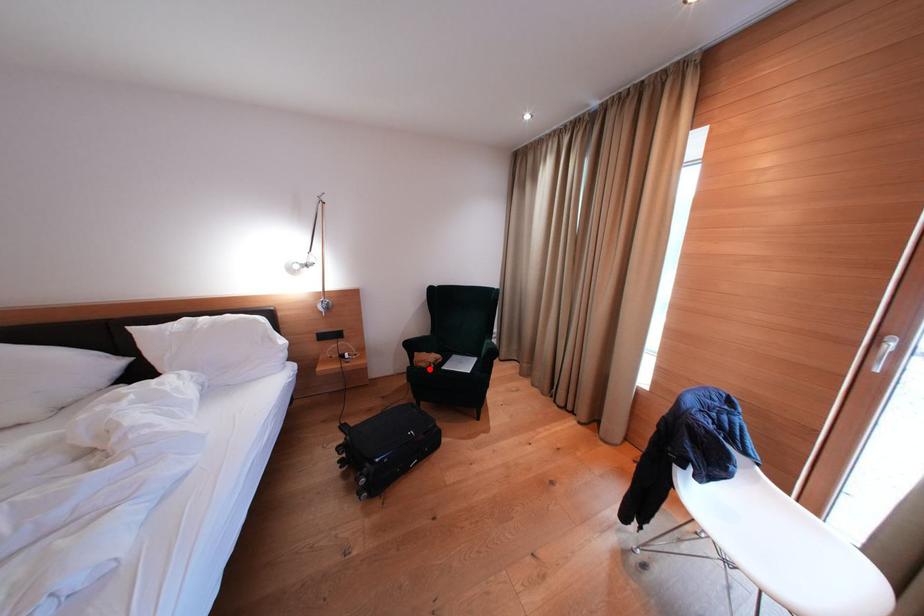
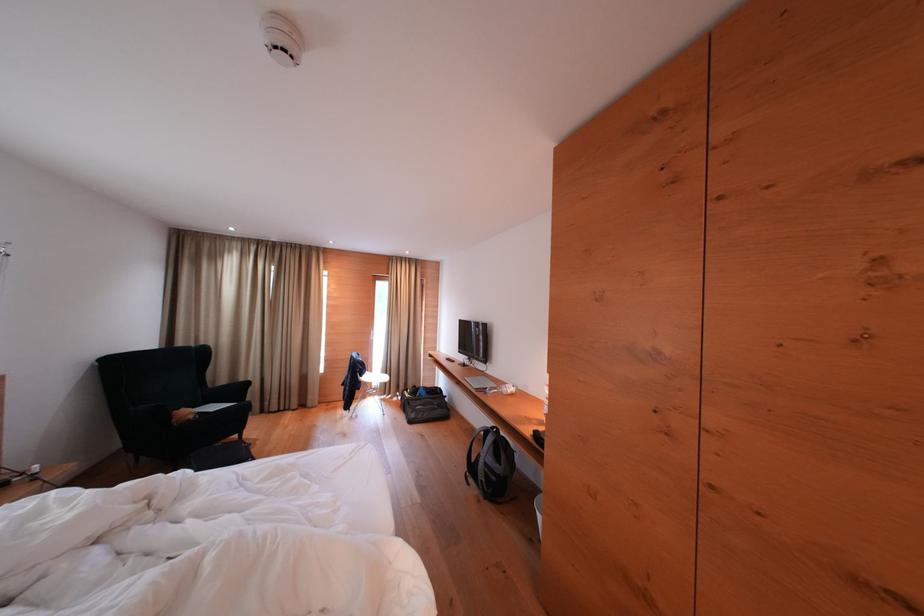
Question: I am providing you with two images of the same scene from different viewpoints. A red point is shown in image1. For the corresponding object point in image2, is it positioned nearer or farther from the camera?

Choices:
 (A) Nearer
 (B) Farther

Answer: (A)